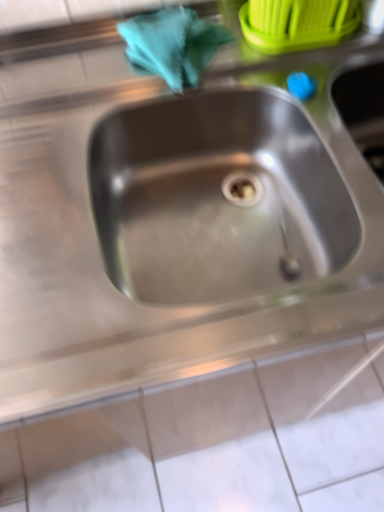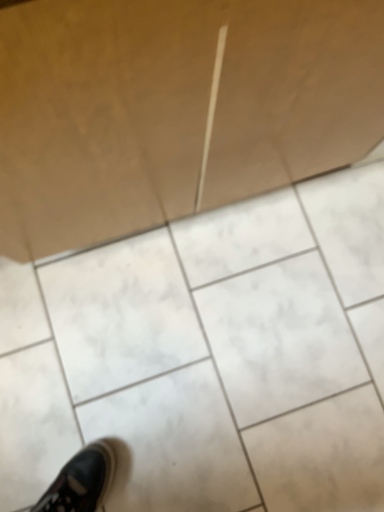
Question: How did the camera likely rotate when shooting the video?

Choices:
 (A) rotated upward
 (B) rotated downward

Answer: (B)